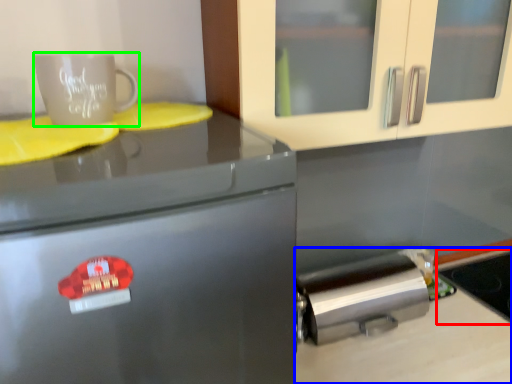
Question: Based on their relative distances, which object is nearer to appliance (highlighted by a red box)? Choose from counter top (highlighted by a blue box) and coffee cup (highlighted by a green box).

Choices:
 (A) counter top
 (B) coffee cup

Answer: (A)